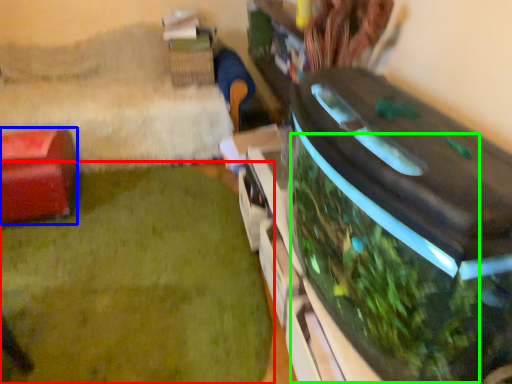
Question: Based on their relative distances, which object is farther from plant (highlighted by a red box)? Choose from furniture (highlighted by a blue box) and vegetation (highlighted by a green box).

Choices:
 (A) furniture
 (B) vegetation

Answer: (B)